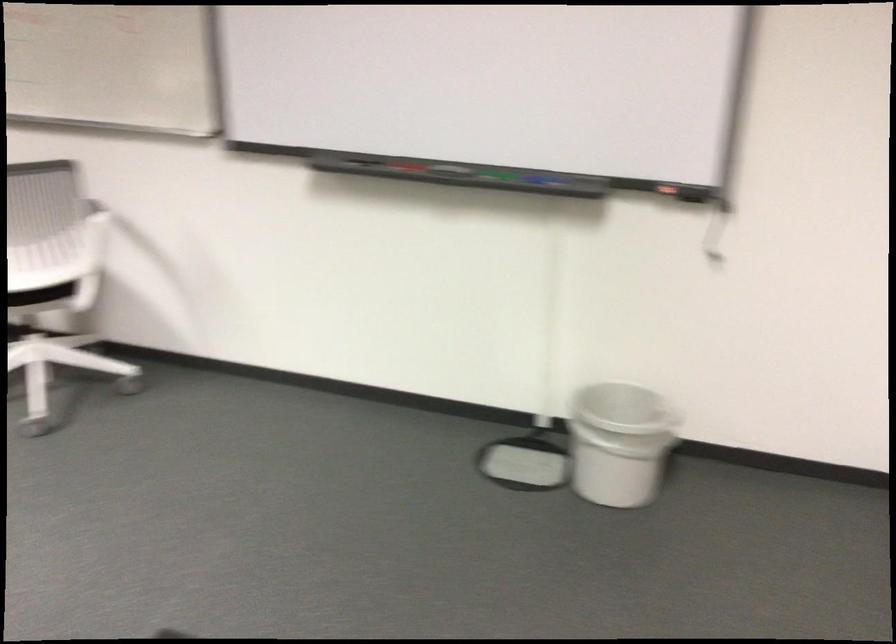
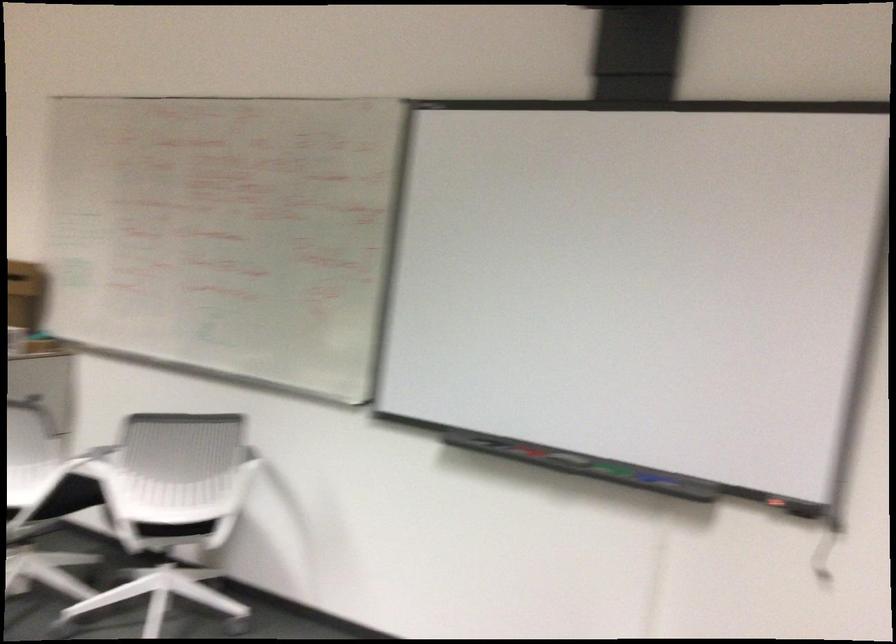
In the second image, find the point that corresponds to [403,167] in the first image.

(527, 451)